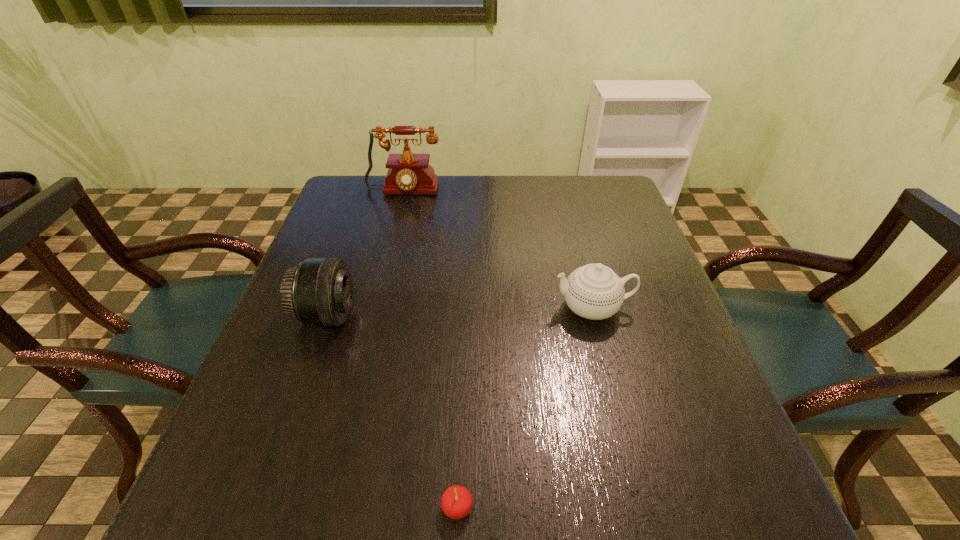
Identify the location of vacant area between the telephone and the telephoto lens. The height and width of the screenshot is (540, 960). (365, 254).

Locate an element on the screen. blank region between the farthest object and the shortest object is located at coordinates (430, 350).

I want to click on unoccupied position between the telephoto lens and the second object from right to left, so click(x=392, y=411).

Select which object is the third closest to the rightmost object. Please provide its 2D coordinates. Your answer should be formatted as a tuple, i.e. [(x, y)], where the tuple contains the x and y coordinates of a point satisfying the conditions above.

[(408, 173)]

The width and height of the screenshot is (960, 540). Identify the location of object that is the nearest to the telephoto lens. (456, 502).

I want to click on free space that satisfies the following two spatial constraints: 1. on the dial of the tallest object; 2. on the left side of the second object from right to left, so click(325, 508).

Image resolution: width=960 pixels, height=540 pixels. Find the location of `vacant space that satisfies the following two spatial constraints: 1. on the dial of the telephone; 2. on the front-facing side of the telephoto lens`. vacant space that satisfies the following two spatial constraints: 1. on the dial of the telephone; 2. on the front-facing side of the telephoto lens is located at coordinates (372, 315).

Where is `vacant space that satisfies the following two spatial constraints: 1. on the dial of the telephone; 2. on the front-facing side of the telephoto lens`? The image size is (960, 540). vacant space that satisfies the following two spatial constraints: 1. on the dial of the telephone; 2. on the front-facing side of the telephoto lens is located at coordinates (372, 315).

The height and width of the screenshot is (540, 960). In order to click on free spot that satisfies the following two spatial constraints: 1. on the spout of the chinaware; 2. on the front side of the cherry in this screenshot , I will do `click(645, 508)`.

Where is `vacant space that satisfies the following two spatial constraints: 1. on the dial of the farthest object; 2. on the front-facing side of the telephoto lens`? This screenshot has width=960, height=540. vacant space that satisfies the following two spatial constraints: 1. on the dial of the farthest object; 2. on the front-facing side of the telephoto lens is located at coordinates (372, 315).